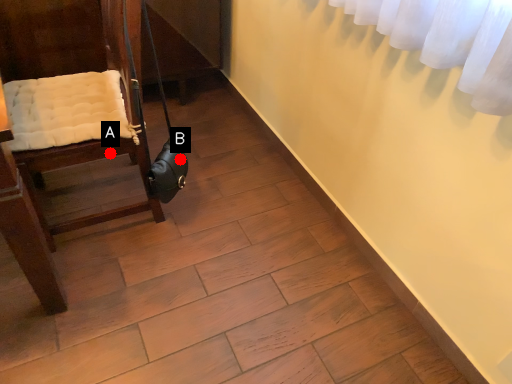
Question: Two points are circled on the image, labeled by A and B beside each circle. Which of the following is the closest to the observer?

Choices:
 (A) A is closer
 (B) B is closer

Answer: (A)